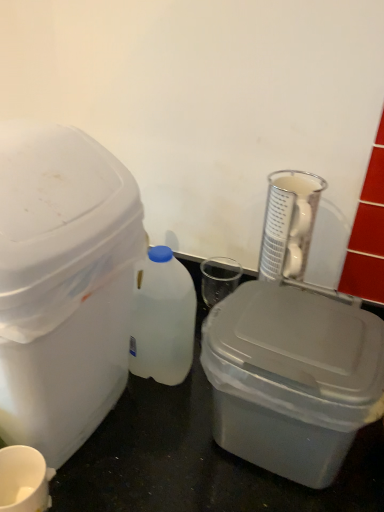
Question: Considering the relative sizes of white plastic bottle at center and gray plastic storage box at center, which is counted as the 1th storage box, starting from the right, in the image provided, is white plastic bottle at center taller than gray plastic storage box at center, which is counted as the 1th storage box, starting from the right,?

Choices:
 (A) yes
 (B) no

Answer: (A)

Question: Is white plastic bottle at center to the left of gray plastic storage box at center, which is counted as the 1th storage box, starting from the right, from the viewer's perspective?

Choices:
 (A) yes
 (B) no

Answer: (A)

Question: Is there a large distance between white plastic bottle at center and gray plastic storage box at center, positioned as the 2th storage box in left-to-right order?

Choices:
 (A) yes
 (B) no

Answer: (B)

Question: Are white plastic bottle at center and gray plastic storage box at center, positioned as the 2th storage box in left-to-right order, beside each other?

Choices:
 (A) yes
 (B) no

Answer: (B)

Question: Can you confirm if white plastic bottle at center is smaller than gray plastic storage box at center, positioned as the 2th storage box in left-to-right order?

Choices:
 (A) yes
 (B) no

Answer: (A)

Question: Could you tell me if white plastic bottle at center is turned towards gray plastic storage box at center, positioned as the 2th storage box in left-to-right order?

Choices:
 (A) yes
 (B) no

Answer: (B)

Question: From the image's perspective, is clear glass beaker at upper right beneath white matte cup at lower left?

Choices:
 (A) yes
 (B) no

Answer: (B)

Question: From a real-world perspective, is clear glass beaker at upper right beneath white matte cup at lower left?

Choices:
 (A) no
 (B) yes

Answer: (A)

Question: Can you confirm if clear glass beaker at upper right is positioned to the left of white matte cup at lower left?

Choices:
 (A) yes
 (B) no

Answer: (B)

Question: Does clear glass beaker at upper right have a lesser height compared to white matte cup at lower left?

Choices:
 (A) yes
 (B) no

Answer: (A)

Question: Is clear glass beaker at upper right in contact with white matte cup at lower left?

Choices:
 (A) yes
 (B) no

Answer: (B)

Question: Does clear glass beaker at upper right appear on the right side of white matte cup at lower left?

Choices:
 (A) no
 (B) yes

Answer: (B)

Question: Can you see white plastic bottle at center touching white matte cup at lower left?

Choices:
 (A) no
 (B) yes

Answer: (A)